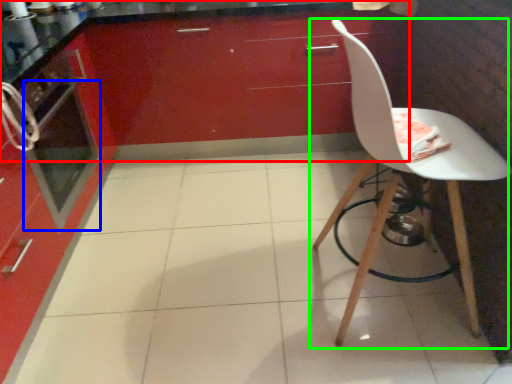
Question: Which is nearer to the cabinetry (highlighted by a red box)? oven (highlighted by a blue box) or chair (highlighted by a green box).

Choices:
 (A) oven
 (B) chair

Answer: (A)